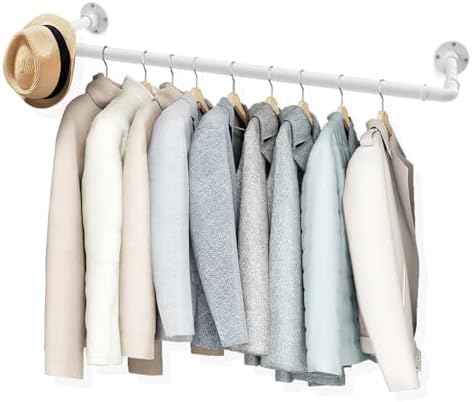
I want to click on wooden coat hanger, so click(x=384, y=114), click(x=344, y=112), click(x=304, y=106), click(x=276, y=103), click(x=239, y=101), click(x=199, y=96), click(x=144, y=85).